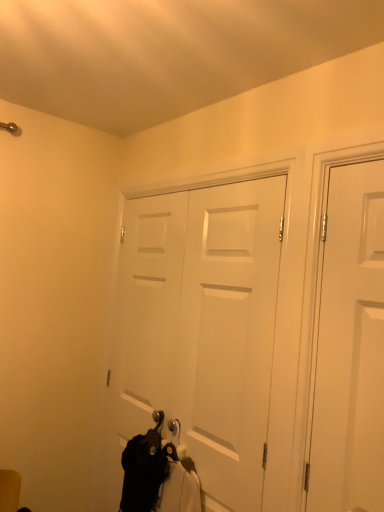
The height and width of the screenshot is (512, 384). Describe the element at coordinates (350, 347) in the screenshot. I see `white matte door at right, placed as the first door when sorted from front to back` at that location.

Where is `white matte door at center, which is the 1th door in left-to-right order`? The image size is (384, 512). white matte door at center, which is the 1th door in left-to-right order is located at coordinates (202, 326).

Between black fabric at lower center and white matte door at center, acting as the 2th door starting from the right, which one has larger width?

black fabric at lower center is wider.

Is black fabric at lower center smaller than white matte door at center, acting as the 2th door starting from the right?

Indeed, black fabric at lower center has a smaller size compared to white matte door at center, acting as the 2th door starting from the right.

Could you measure the distance between black fabric at lower center and white matte door at center, the 2th door from the front?

They are 13.74 inches apart.

Does black fabric at lower center have a greater width compared to white matte door at right, the 2th door from the back?

Correct, the width of black fabric at lower center exceeds that of white matte door at right, the 2th door from the back.

Which object is positioned more to the right, black fabric at lower center or white matte door at right, the second door when ordered from left to right?

white matte door at right, the second door when ordered from left to right, is more to the right.

Identify the location of the 2nd door located above the black fabric at lower center (from a real-world perspective). (350, 347).

Considering the relative sizes of black fabric at lower center and white matte door at right, the 2th door from the back, in the image provided, is black fabric at lower center bigger than white matte door at right, the 2th door from the back,?

Yes, black fabric at lower center is bigger than white matte door at right, the 2th door from the back.

In the image, there is a white matte door at right, the second door when ordered from left to right. What are the coordinates of `door below it (from a real-world perspective)` in the screenshot? It's located at click(202, 326).

Considering the positions of points (237, 277) and (372, 162), is point (237, 277) closer to camera compared to point (372, 162)?

No, (237, 277) is behind (372, 162).

From a real-world perspective, is white matte door at center, marked as the first door in a back-to-front arrangement, physically above white matte door at right, the second door when ordered from left to right?

No, from a real-world perspective, white matte door at center, marked as the first door in a back-to-front arrangement, is not over white matte door at right, the second door when ordered from left to right

Can you confirm if white matte door at center, which is the 1th door in left-to-right order, is smaller than white matte door at right, the 2th door from the back?

Actually, white matte door at center, which is the 1th door in left-to-right order, might be larger than white matte door at right, the 2th door from the back.

Considering the sizes of objects white matte door at right, placed as the first door when sorted from front to back, and black fabric at lower center in the image provided, who is taller, white matte door at right, placed as the first door when sorted from front to back, or black fabric at lower center?

white matte door at right, placed as the first door when sorted from front to back, is taller.

In the scene shown: How distant is white matte door at right, placed as the first door when sorted from front to back, from black fabric at lower center?

white matte door at right, placed as the first door when sorted from front to back, is 30.72 inches away from black fabric at lower center.

Is white matte door at right, positioned as the 1th door in right-to-left order, in front of or behind black fabric at lower center in the image?

Visually, white matte door at right, positioned as the 1th door in right-to-left order, is located in front of black fabric at lower center.

How different are the orientations of white matte door at right, placed as the first door when sorted from front to back, and black fabric at lower center in degrees?

white matte door at right, placed as the first door when sorted from front to back, and black fabric at lower center are facing 0.468 degrees away from each other.

Which object is positioned more to the right, white matte door at center, the 2th door from the front, or black fabric at lower center?

white matte door at center, the 2th door from the front.

Consider the image. Is black fabric at lower center at the back of white matte door at center, the 2th door from the front?

Yes, black fabric at lower center is at the back of white matte door at center, the 2th door from the front.

Which object is more forward, white matte door at center, marked as the first door in a back-to-front arrangement, or black fabric at lower center?

black fabric at lower center is closer to the camera.

Based on the photo, is white matte door at center, marked as the first door in a back-to-front arrangement, bigger or smaller than black fabric at lower center?

Considering their sizes, white matte door at center, marked as the first door in a back-to-front arrangement, takes up more space than black fabric at lower center.

Is point (317, 474) positioned in front of point (163, 256)?

Yes, point (317, 474) is closer to viewer.

Is white matte door at right, the 2th door from the back, outside of white matte door at center, the 2th door from the front?

white matte door at right, the 2th door from the back, lies outside white matte door at center, the 2th door from the front,'s area.

Looking at this image, is white matte door at right, the 2th door from the back, at the right side of white matte door at center, marked as the first door in a back-to-front arrangement?

Yes.

Identify the location of laundry beneath the white matte door at center, marked as the first door in a back-to-front arrangement (from a real-world perspective). pyautogui.click(x=157, y=475).

Identify the location of the 2nd door to the right of the black fabric at lower center, counting from the anchor's position. (350, 347).

Based on their spatial positions, is white matte door at right, positioned as the 1th door in right-to-left order, or black fabric at lower center closer to white matte door at center, acting as the 2th door starting from the right?

black fabric at lower center is closer to white matte door at center, acting as the 2th door starting from the right.

Which object lies further to the anchor point white matte door at right, positioned as the 1th door in right-to-left order, white matte door at center, which is the 1th door in left-to-right order, or black fabric at lower center?

The object further to white matte door at right, positioned as the 1th door in right-to-left order, is black fabric at lower center.

When comparing their distances from black fabric at lower center, does white matte door at right, the 2th door from the back, or white matte door at center, acting as the 2th door starting from the right, seem further?

Based on the image, white matte door at right, the 2th door from the back, appears to be further to black fabric at lower center.

Which object lies further to the anchor point black fabric at lower center, white matte door at center, acting as the 2th door starting from the right, or white matte door at right, the second door when ordered from left to right?

white matte door at right, the second door when ordered from left to right, is positioned further to the anchor black fabric at lower center.

Looking at the image, which one is located closer to white matte door at center, marked as the first door in a back-to-front arrangement, black fabric at lower center or white matte door at right, placed as the first door when sorted from front to back?

black fabric at lower center.

Based on their spatial positions, is black fabric at lower center or white matte door at center, which is the 1th door in left-to-right order, closer to white matte door at right, placed as the first door when sorted from front to back?

white matte door at center, which is the 1th door in left-to-right order, is closer to white matte door at right, placed as the first door when sorted from front to back.

This screenshot has width=384, height=512. Find the location of `door that lies between white matte door at right, placed as the first door when sorted from front to back, and black fabric at lower center from top to bottom`. door that lies between white matte door at right, placed as the first door when sorted from front to back, and black fabric at lower center from top to bottom is located at coordinates (202, 326).